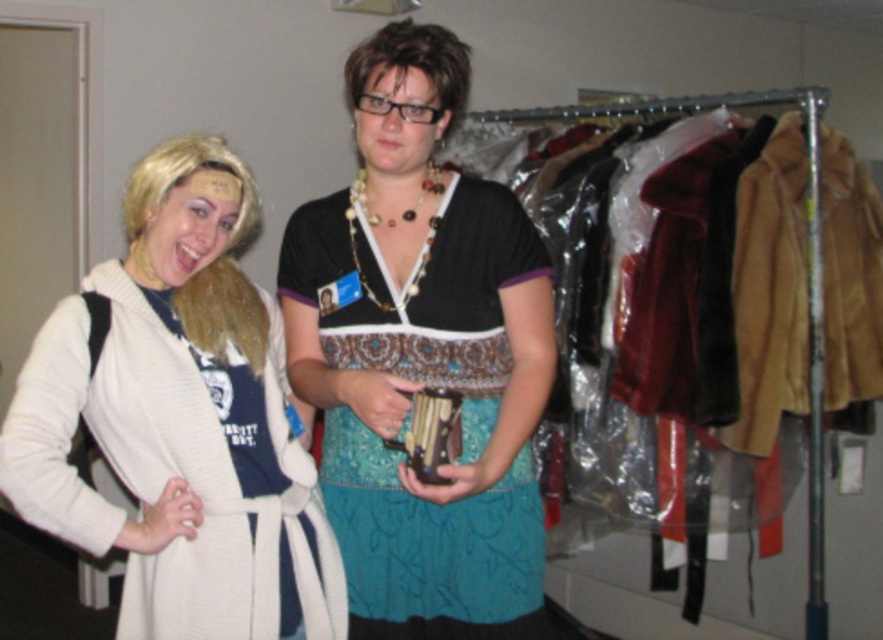
Which is more to the left, matte black top at center or white knit sweater at left?

white knit sweater at left

Is matte black top at center above white knit sweater at left?

Yes, matte black top at center is above white knit sweater at left.

Between point (365, 198) and point (190, 246), which one is positioned in front?

Positioned in front is point (190, 246).

The image size is (883, 640). I want to click on matte black top at center, so click(x=421, y=356).